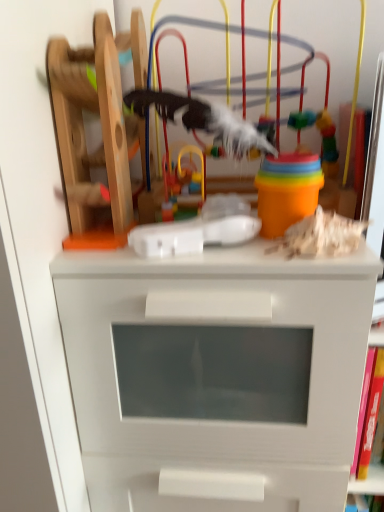
Question: From the image's perspective, is multicolored plastic toy at center, which appears as the 3th toy when viewed from the right, below wooden roller coaster at left, the 1th toy from the left?

Choices:
 (A) yes
 (B) no

Answer: (A)

Question: Can you confirm if multicolored plastic toy at center, which is the 2th toy in left-to-right order, is smaller than wooden roller coaster at left, the 1th toy from the left?

Choices:
 (A) no
 (B) yes

Answer: (B)

Question: Is multicolored plastic toy at center, which is the 2th toy in left-to-right order, facing away from wooden roller coaster at left, the 1th toy from the left?

Choices:
 (A) yes
 (B) no

Answer: (B)

Question: Considering the relative positions of multicolored plastic toy at center, which appears as the 3th toy when viewed from the right, and wooden roller coaster at left, which appears as the 4th toy when viewed from the right, in the image provided, is multicolored plastic toy at center, which appears as the 3th toy when viewed from the right, to the right of wooden roller coaster at left, which appears as the 4th toy when viewed from the right, from the viewer's perspective?

Choices:
 (A) no
 (B) yes

Answer: (B)

Question: Is wooden roller coaster at left, which appears as the 4th toy when viewed from the right, located within multicolored plastic toy at center, which is the 2th toy in left-to-right order?

Choices:
 (A) yes
 (B) no

Answer: (B)

Question: Is multicolored plastic toy at center, which is the 2th toy in left-to-right order, at the left side of wooden roller coaster at left, the 1th toy from the left?

Choices:
 (A) yes
 (B) no

Answer: (B)

Question: Can you confirm if white matte chest of drawers at center is bigger than wooden toy at upper right, which appears as the first toy when viewed from the right?

Choices:
 (A) yes
 (B) no

Answer: (A)

Question: Is white matte chest of drawers at center at the left side of wooden toy at upper right, positioned as the 4th toy in left-to-right order?

Choices:
 (A) yes
 (B) no

Answer: (A)

Question: From a real-world perspective, is white matte chest of drawers at center physically above wooden toy at upper right, positioned as the 4th toy in left-to-right order?

Choices:
 (A) yes
 (B) no

Answer: (B)

Question: Is white matte chest of drawers at center closer to the viewer compared to wooden toy at upper right, positioned as the 4th toy in left-to-right order?

Choices:
 (A) no
 (B) yes

Answer: (B)

Question: Is white matte chest of drawers at center placed right next to wooden toy at upper right, which appears as the first toy when viewed from the right?

Choices:
 (A) yes
 (B) no

Answer: (B)

Question: Does white matte chest of drawers at center appear on the right side of wooden toy at upper right, which appears as the first toy when viewed from the right?

Choices:
 (A) no
 (B) yes

Answer: (A)

Question: Is multicolored plastic toy at center, which is the 2th toy in left-to-right order, positioned behind wooden toy at upper right, positioned as the 4th toy in left-to-right order?

Choices:
 (A) yes
 (B) no

Answer: (A)